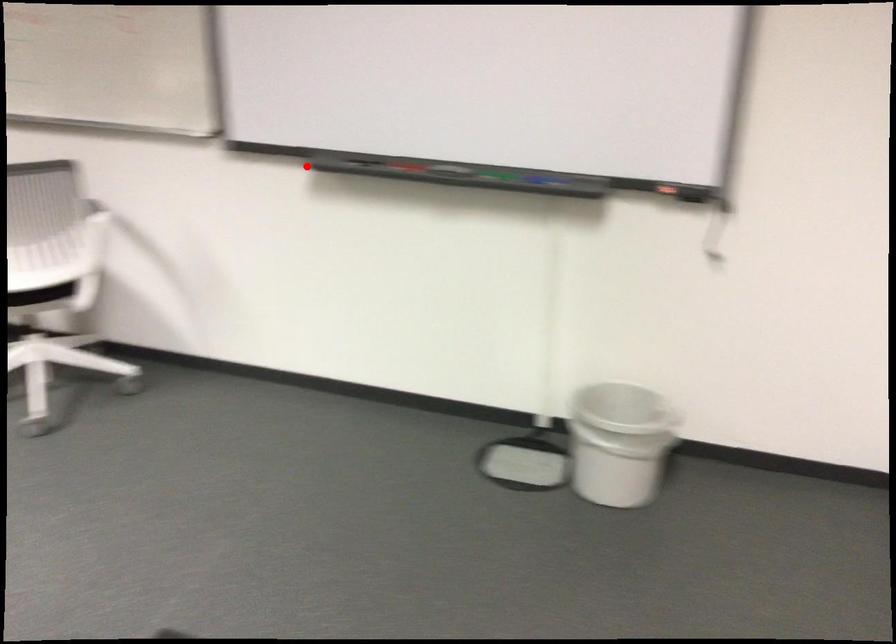
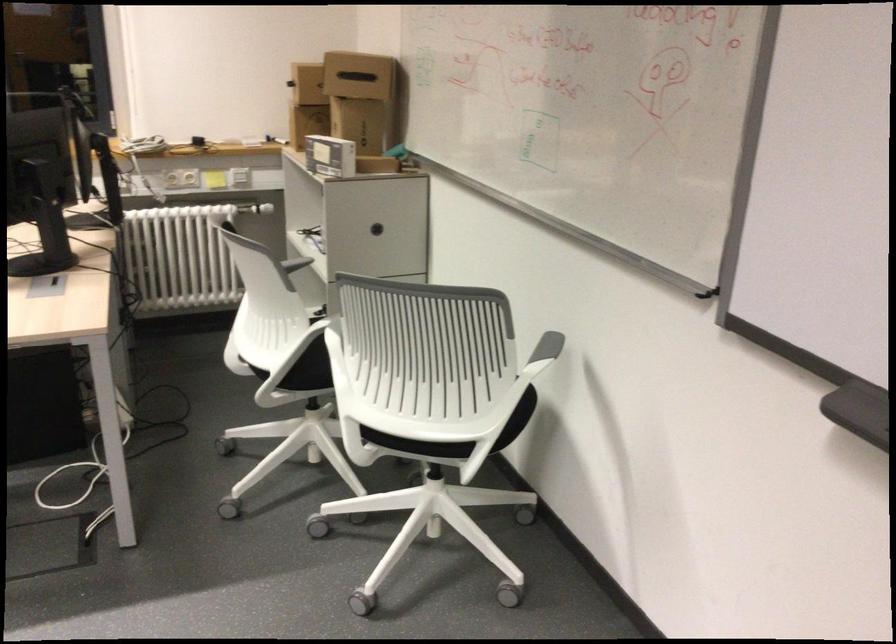
Question: I am providing you with two images of the same scene from different viewpoints. Image1 has a red point marked. In image2, the corresponding 3D location appears at what relative position? Reply with the corresponding letter.

Choices:
 (A) Closer
 (B) Farther

Answer: (A)